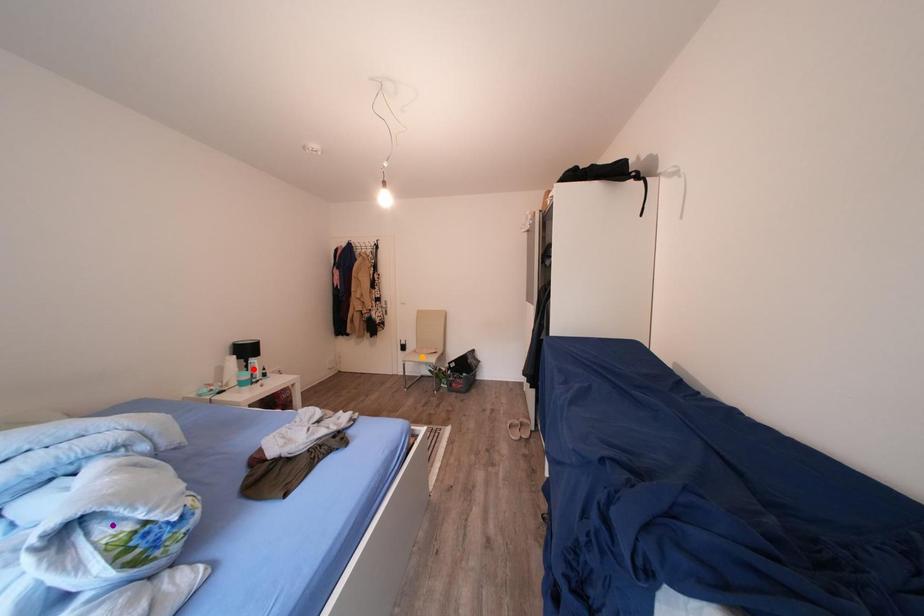
Order these from nearest to farthest:
red point
purple point
orange point

purple point
red point
orange point